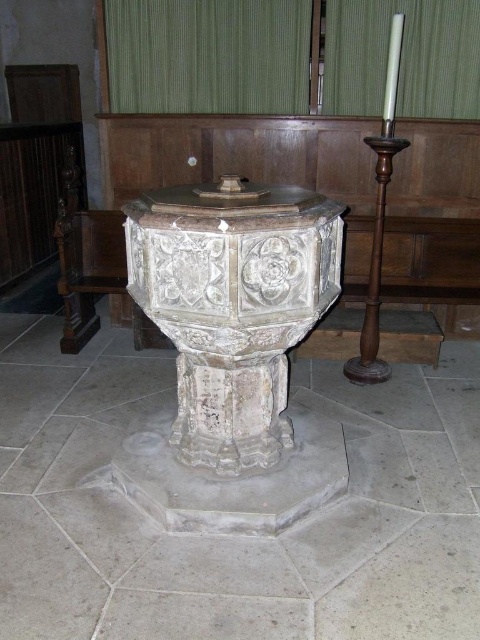
You are standing in the church and want to place a small decoration on the baptismal font. You have a 1.5 meter long pole that you can use to reach the font. The point you need to reach is at coordinate point (177, 269). Can you determine if the pole is long enough to reach that point?

The distance of point (177, 269) from camera is 2.21 meters. Since the pole is only 1.5 meters long, it is not long enough to reach the point (177, 269).

You are an interior designer planning to place a 1.2 meter wide decorative panel between the white stone baptismal font at center and the carved stone baptismal font at center. Can the panel fit between them?

The white stone baptismal font at center might be wider than carved stone baptismal font at center, so the 1.2 meter wide decorative panel may or may not fit between them depending on the exact width difference.